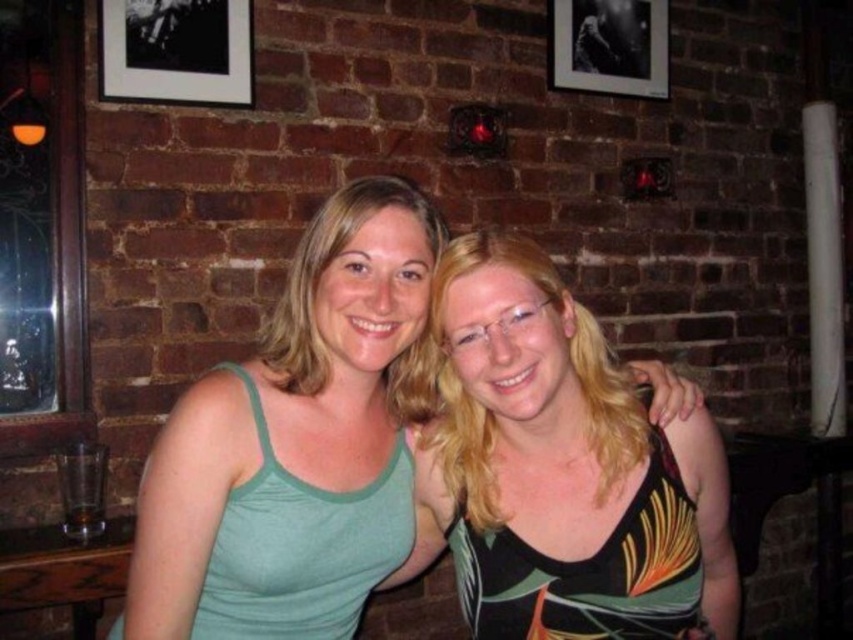
You are an interior designer assessing the placement of items in this scene. The green textured tank top at center and the black matte picture frame at upper left are both in view. Which object is positioned to the right side of the other?

The green textured tank top at center is to the right of the black matte picture frame at upper left.

You are standing 5 feet away from the brick wall. You want to reach the green fabric tank top at center without moving your feet. Can you touch it with your outstretched hand?

The green fabric tank top at center is 3.42 feet away from the viewer. Since you are standing 5 feet away from the brick wall, the distance to the tank top would be greater than 3.42 feet, so you cannot reach it with an outstretched hand.

You are an interior designer planning to hang a new artwork between the green textured tank top at center and the black matte picture frame at upper right. Based on their sizes, which object should you consider placing closer to the center of the wall?

The green textured tank top at center is bigger than the black matte picture frame at upper right, so you should place the larger green textured tank top at center closer to the center of the wall to balance the composition.